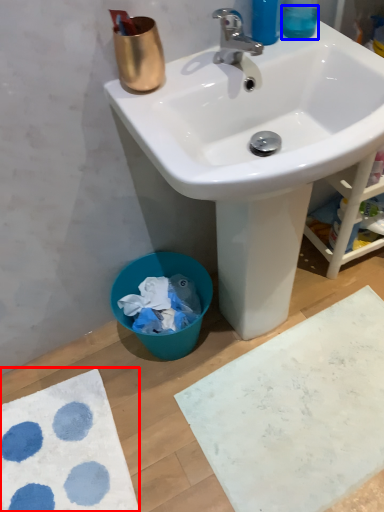
Question: Which of the following is the closest to the observer, bath mat (highlighted by a red box) or liquid (highlighted by a blue box)?

Choices:
 (A) bath mat
 (B) liquid

Answer: (B)